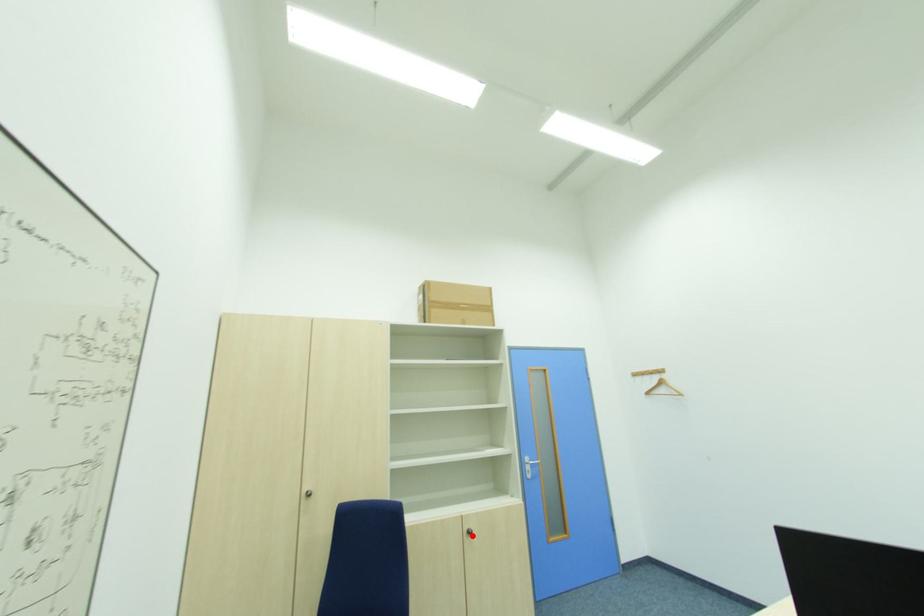
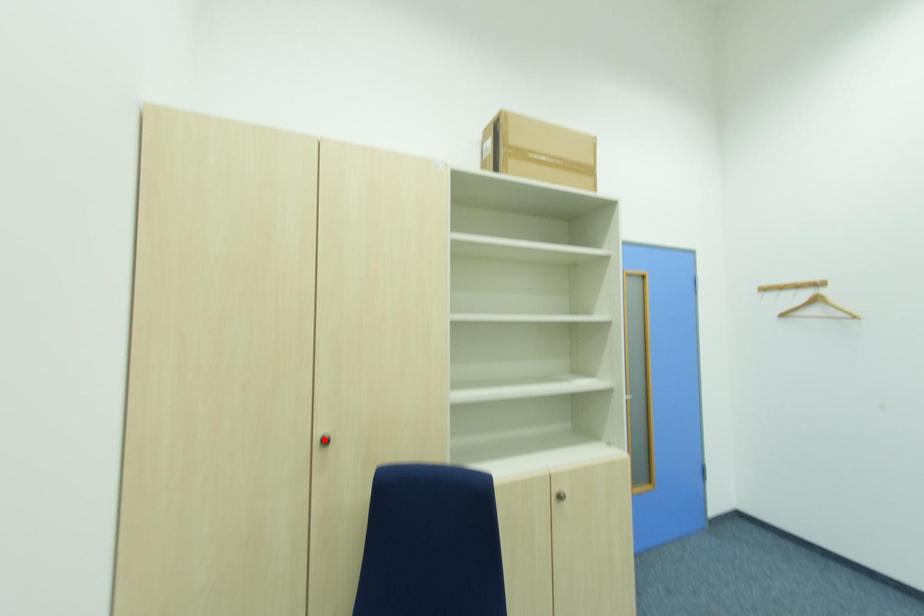
I am providing you with two images of the same scene from different viewpoints. A red point is marked on the first image and another point is marked on the second image. Do the highlighted points in image1 and image2 indicate the same real-world spot?

No